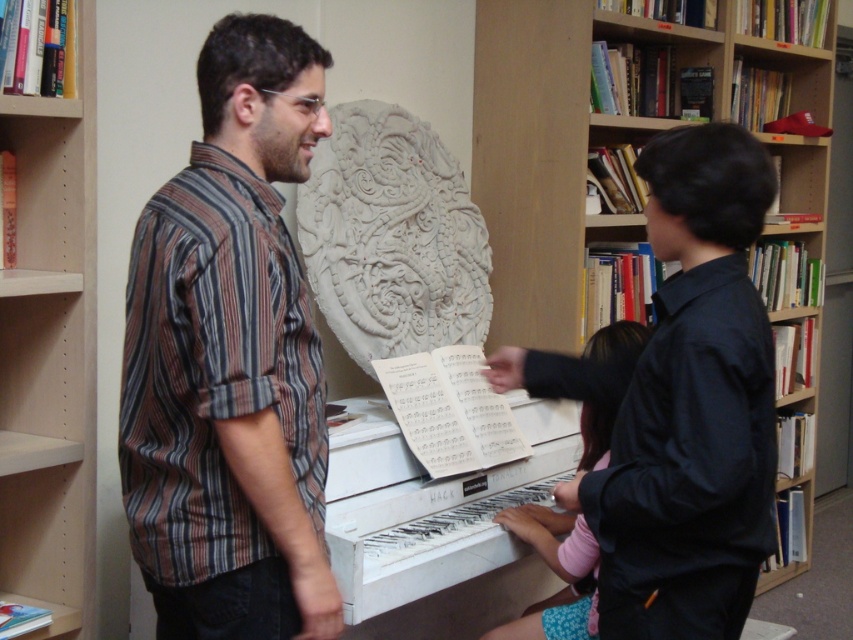
Between striped cotton shirt at center and pink fabric at piano, which one has less height?

pink fabric at piano is shorter.

Does striped cotton shirt at center have a greater height compared to pink fabric at piano?

Correct, striped cotton shirt at center is much taller as pink fabric at piano.

Is point (225, 349) positioned after point (579, 612)?

No, (225, 349) is closer to viewer.

I want to click on striped cotton shirt at center, so point(230,358).

At what (x,y) coordinates should I click in order to perform the action: click on light brown wood bookshelf at left. Please return your answer as a coordinate pair (x, y). The width and height of the screenshot is (853, 640). Looking at the image, I should click on (50, 355).

Is light brown wood bookshelf at left to the left of pink fabric at piano from the viewer's perspective?

Yes, light brown wood bookshelf at left is to the left of pink fabric at piano.

Locate an element on the screen. The width and height of the screenshot is (853, 640). light brown wood bookshelf at left is located at coordinates (50, 355).

Locate an element on the screen. light brown wood bookshelf at left is located at coordinates (50, 355).

Is wooden bookshelf at upper center to the right of pink fabric at piano from the viewer's perspective?

Correct, you'll find wooden bookshelf at upper center to the right of pink fabric at piano.

Between point (563, 257) and point (585, 449), which one is positioned in front?

Point (585, 449) is in front.

Find the location of `wooden bookshelf at upper center`. wooden bookshelf at upper center is located at coordinates (582, 141).